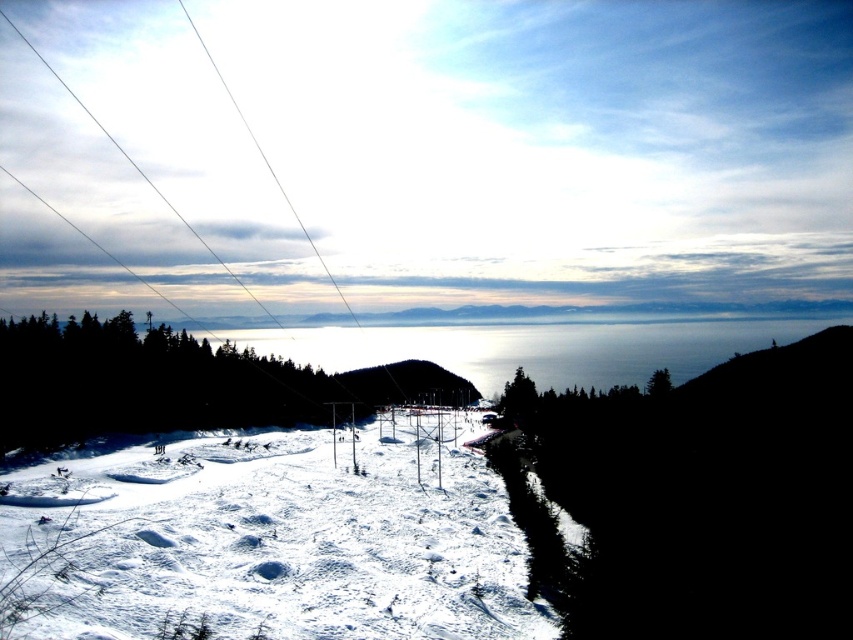
You are a snowboarder planning to jump from the white powdery snow at center to the black matte hill at lower right. Given that your snowboard can jump up to 50 meters, will you be able to make the jump successfully?

The white powdery snow at center is 52.46 meters away from the black matte hill at lower right. Since your snowboard can only jump up to 50 meters, you will not be able to make the jump successfully.

You are a skier planning to descend the slope. You see the white powdery snow at center and the black matte hill at lower right. Which terrain feature is closer to you as you start your descent?

The white powdery snow at center is closer to you because it is in front of the black matte hill at lower right, meaning it lies between you and the hill.